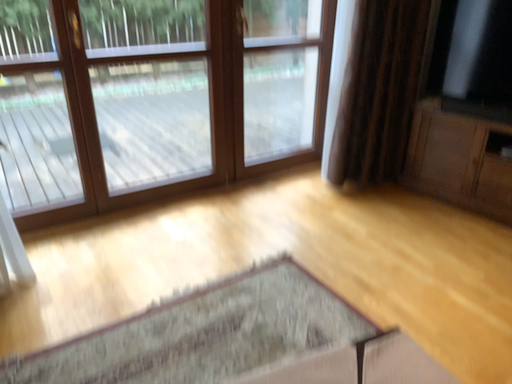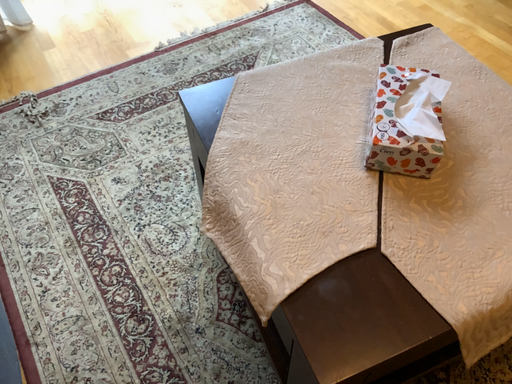
Question: How did the camera likely rotate when shooting the video?

Choices:
 (A) rotated downward
 (B) rotated upward

Answer: (A)